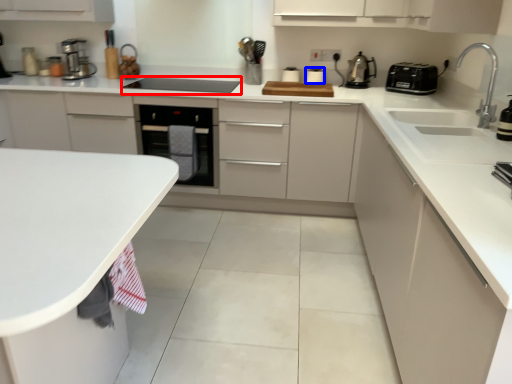
Question: Which object is closer to the camera taking this photo, appliance (highlighted by a red box) or appliance (highlighted by a blue box)?

Choices:
 (A) appliance
 (B) appliance

Answer: (A)